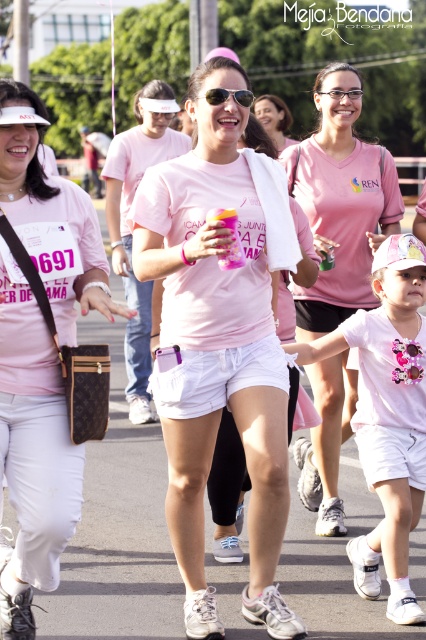
Can you confirm if pink fabric shorts at center is bigger than pink fabric shirt at center?

Actually, pink fabric shorts at center might be smaller than pink fabric shirt at center.

Is pink fabric shorts at center above pink fabric shirt at center?

Incorrect, pink fabric shorts at center is not positioned above pink fabric shirt at center.

Locate an element on the screen. The height and width of the screenshot is (640, 426). pink fabric shorts at center is located at coordinates (129, 228).

You are a GUI agent. You are given a task and a screenshot of the screen. Output one action in this format:
    pyautogui.click(x=<x>, y=<y>)
    Task: Click on the pink fabric shorts at center
    This screenshot has height=640, width=426.
    Given the screenshot: What is the action you would take?
    pyautogui.click(x=129, y=228)

Is point (357, 161) positioned in front of point (264, 122)?

Yes, point (357, 161) is closer to viewer.

The image size is (426, 640). I want to click on pink matte t-shirt at center, so click(x=340, y=204).

Locate an element on the screen. This screenshot has width=426, height=640. pink matte t-shirt at center is located at coordinates (340, 204).

Who is taller, matte pink shirt at center or pink fabric shirt at center?

Standing taller between the two is matte pink shirt at center.

Which is behind, point (22, 163) or point (278, 125)?

Positioned behind is point (278, 125).

This screenshot has width=426, height=640. Find the location of `matte pink shirt at center`. matte pink shirt at center is located at coordinates (40, 353).